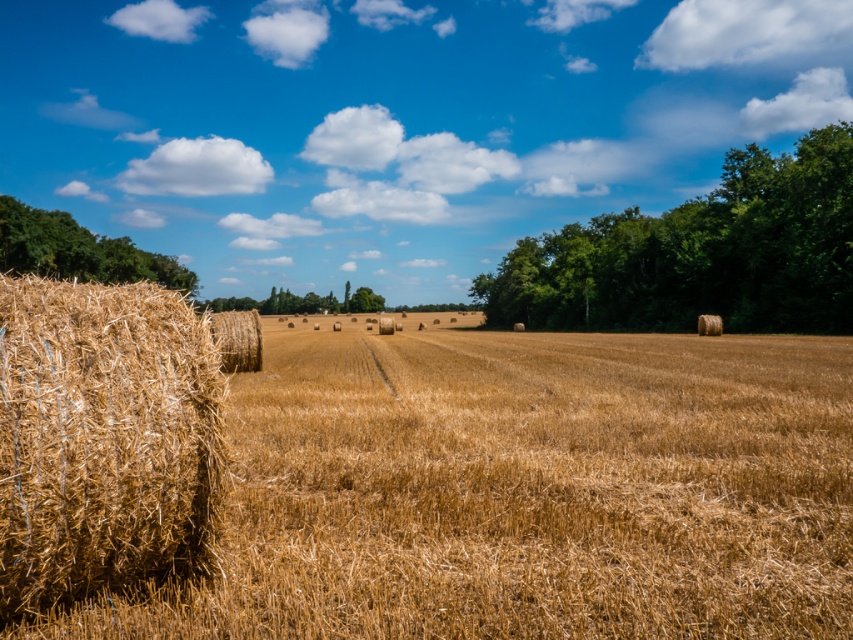
From the picture: Can you confirm if golden straw bales at left is bigger than green leafy tree at right?

No.

Who is lower down, golden straw bales at left or green leafy tree at right?

golden straw bales at left is lower down.

Image resolution: width=853 pixels, height=640 pixels. Identify the location of golden straw bales at left. (521, 492).

Is golden straw bale at left above green leafy tree at upper left?

Actually, golden straw bale at left is below green leafy tree at upper left.

Does point (167, 544) come closer to viewer compared to point (106, 253)?

Yes, it is in front of point (106, 253).

Find the location of a particular element. golden straw bale at left is located at coordinates (103, 440).

Is green leafy tree at right taller than golden straw bale at center?

Correct, green leafy tree at right is much taller as golden straw bale at center.

Who is more forward, (x=634, y=301) or (x=224, y=314)?

Positioned in front is point (x=224, y=314).

Where is `green leafy tree at right`? The image size is (853, 640). green leafy tree at right is located at coordinates (700, 253).

Find the location of `green leafy tree at right`. green leafy tree at right is located at coordinates (700, 253).